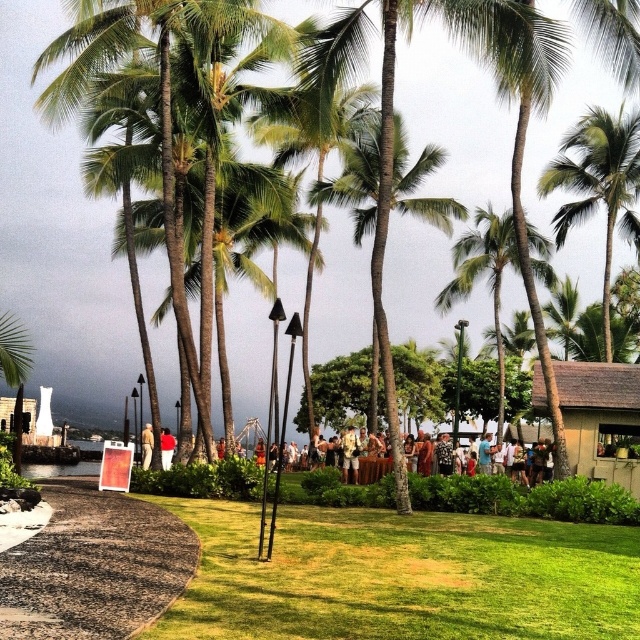
Question: Can you confirm if green grass at center is positioned to the left of multicolored fabric at center?

Choices:
 (A) yes
 (B) no

Answer: (A)

Question: Estimate the real-world distances between objects in this image. Which object is farther from the green grass at center?

Choices:
 (A) red cotton shirt at center
 (B) green leafy palm tree at center
 (C) multicolored fabric at center
 (D) light brown leather jacket at center

Answer: (B)

Question: Where is green grass at center located in relation to multicolored fabric at center in the image?

Choices:
 (A) right
 (B) left

Answer: (B)

Question: Which object appears closest to the camera in this image?

Choices:
 (A) red cotton shirt at center
 (B) green leafy palm tree at center
 (C) multicolored fabric at center
 (D) light brown leather jacket at center

Answer: (A)

Question: Does green leafy palm tree at upper right have a greater width compared to light brown leather jacket at center?

Choices:
 (A) no
 (B) yes

Answer: (B)

Question: Which object appears farthest from the camera in this image?

Choices:
 (A) light brown leather jacket at center
 (B) green leafy palm tree at upper right
 (C) green leafy palm tree at center

Answer: (B)